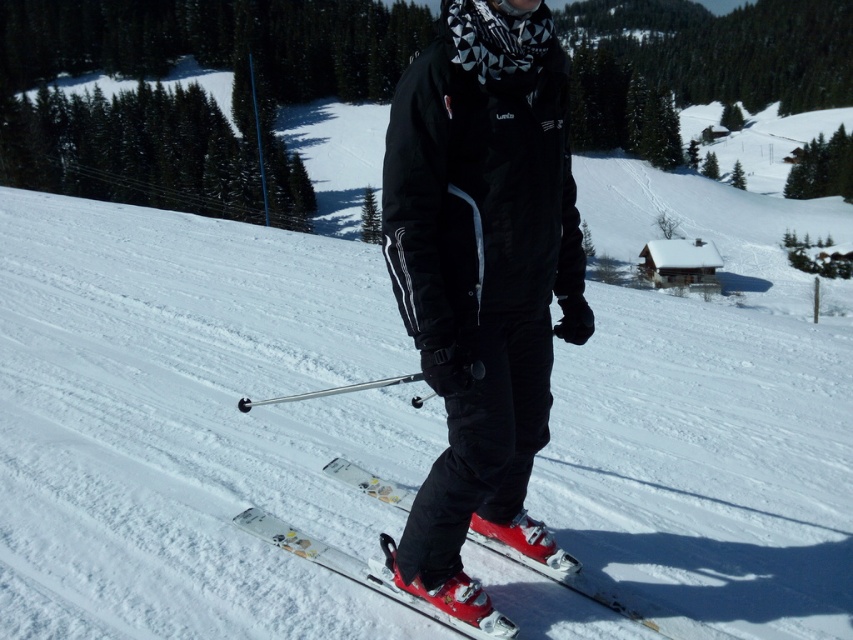
Question: Which object is closer to the camera taking this photo?

Choices:
 (A) white glossy skis at center
 (B) matte black ski suit at center
 (C) white powder snow at center

Answer: (B)

Question: Which point is farther to the camera?

Choices:
 (A) white powder snow at center
 (B) white glossy skis at center
 (C) matte black ski suit at center

Answer: (A)

Question: Does white powder snow at center appear on the left side of white glossy skis at center?

Choices:
 (A) yes
 (B) no

Answer: (A)

Question: Is white powder snow at center to the right of white glossy skis at center from the viewer's perspective?

Choices:
 (A) yes
 (B) no

Answer: (B)

Question: Is white powder snow at center closer to the viewer compared to white glossy skis at center?

Choices:
 (A) yes
 (B) no

Answer: (B)

Question: Which point appears farthest from the camera in this image?

Choices:
 (A) (523, 512)
 (B) (320, 276)
 (C) (534, 563)

Answer: (B)